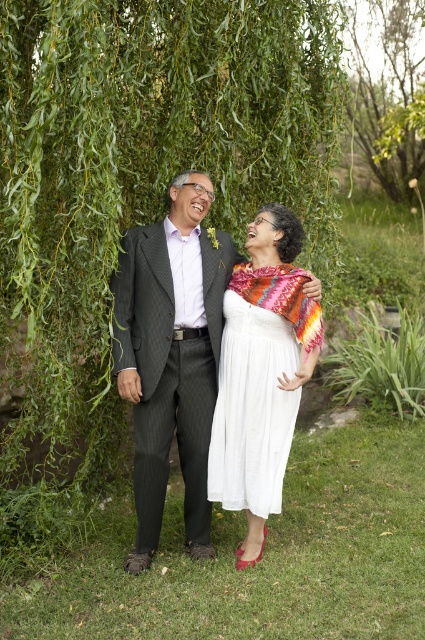
You are a photographer trying to capture the perfect shot of the two people under the willow tree. You notice the white cotton dress at center and the multicolored woven shawl at center. Which of these items will appear bigger in your photo?

The white cotton dress at center will appear bigger in the photo because it has a larger size compared to the multicolored woven shawl at center.